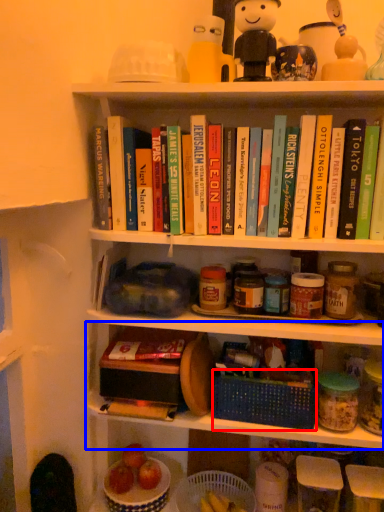
Question: Among these objects, which one is farthest to the camera, basket (highlighted by a red box) or shelf (highlighted by a blue box)?

Choices:
 (A) basket
 (B) shelf

Answer: (A)